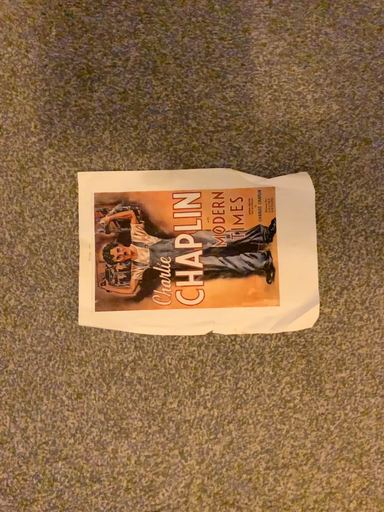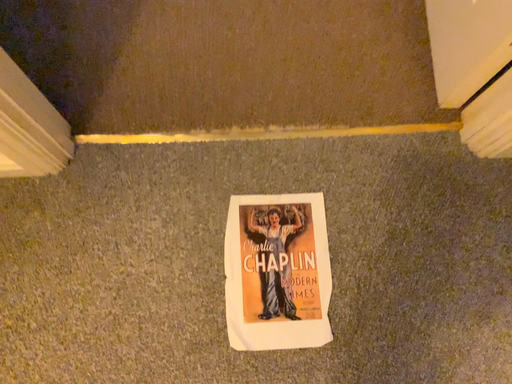
Question: Which way did the camera rotate in the video?

Choices:
 (A) rotated upward
 (B) rotated downward

Answer: (A)